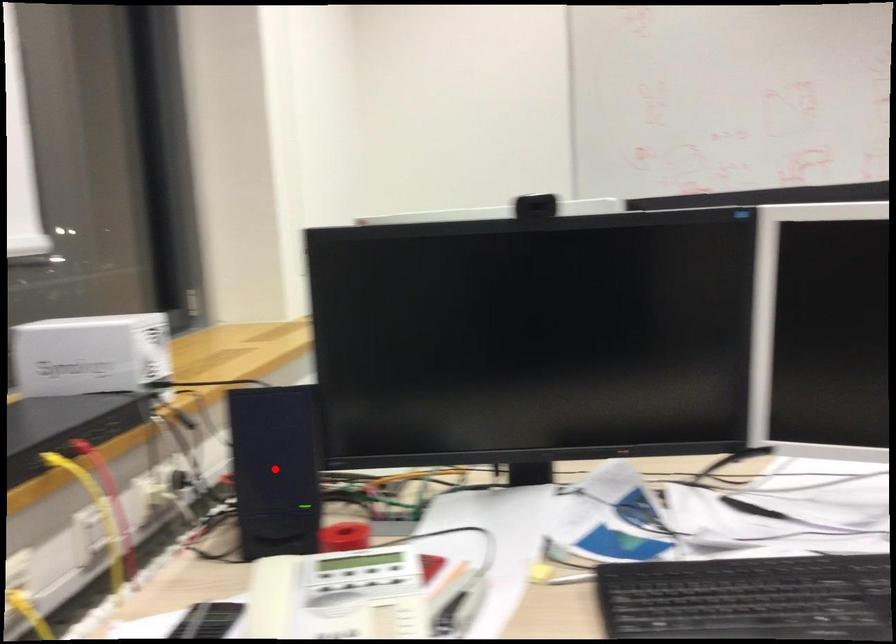
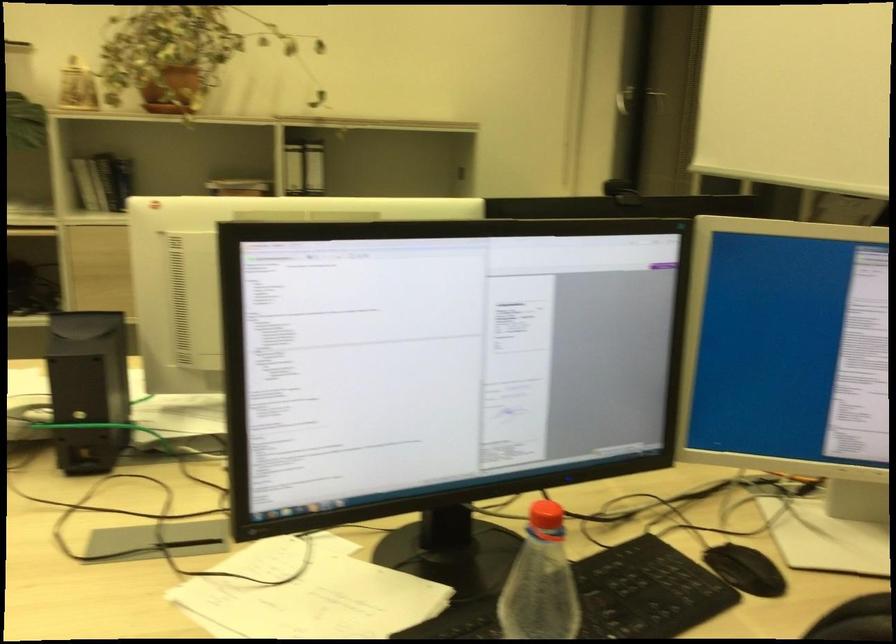
Question: I am providing you with two images of the same scene from different viewpoints. A red point is marked on the first image. Can you still see the location of the red point in image 2?

Choices:
 (A) Yes
 (B) No

Answer: (B)